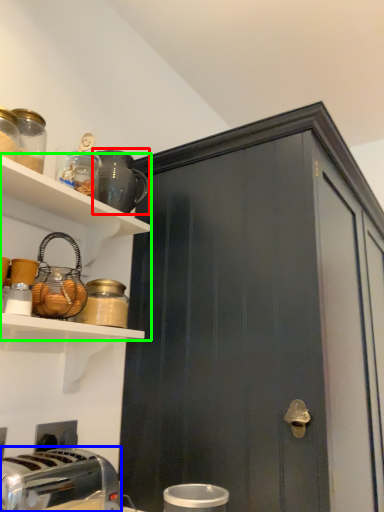
Question: Which object is the closest to the appliance (highlighted by a red box)? Choose among these: toaster (highlighted by a blue box) or shelf (highlighted by a green box).

Choices:
 (A) toaster
 (B) shelf

Answer: (B)